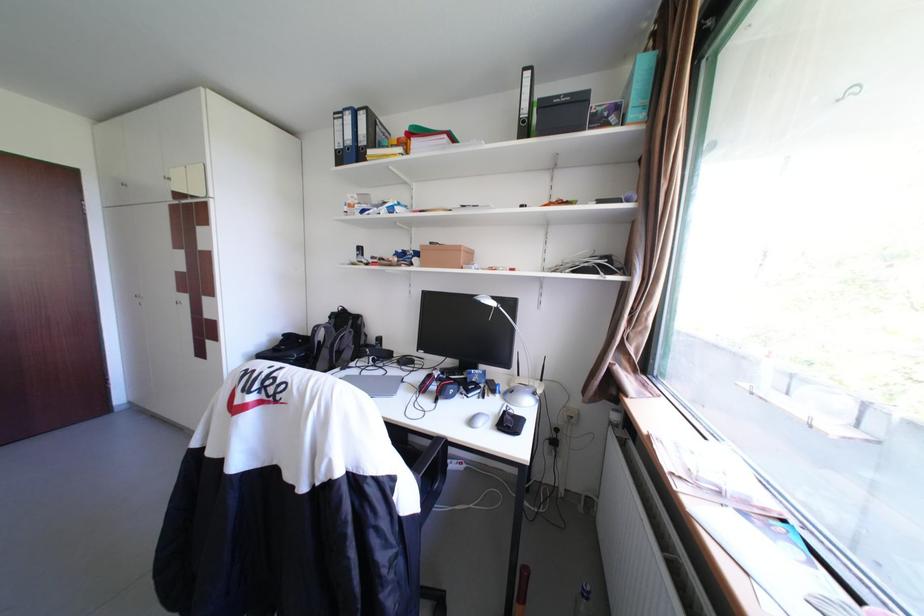
I want to click on desk lamp head, so click(x=488, y=302).